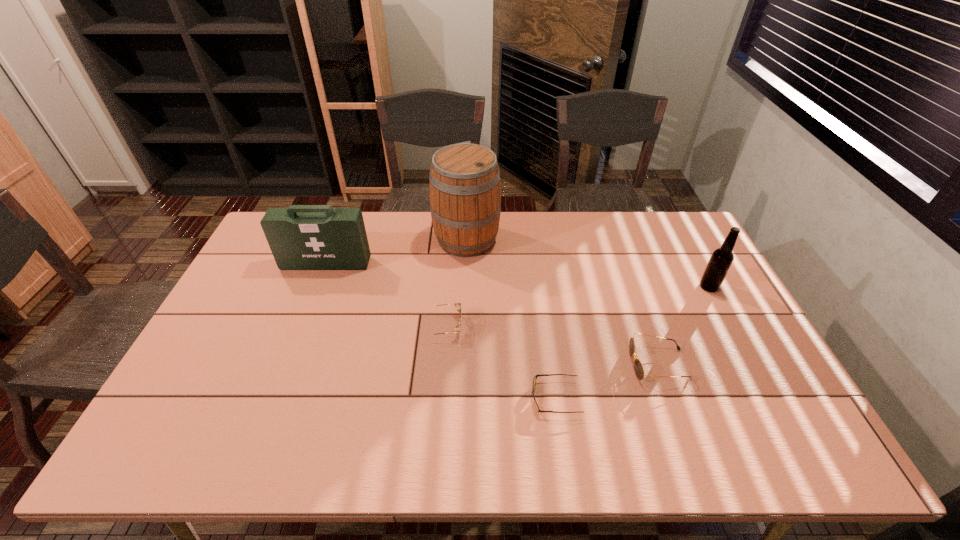
Identify the location of cider. The image size is (960, 540). (464, 184).

I want to click on beer bottle, so click(722, 258).

Where is `the rightmost object`? The image size is (960, 540). the rightmost object is located at coordinates (722, 258).

Where is `the leftmost object`? The height and width of the screenshot is (540, 960). the leftmost object is located at coordinates (301, 237).

You are a GUI agent. You are given a task and a screenshot of the screen. Output one action in this format:
    pyautogui.click(x=<x>, y=<y>)
    Task: Click on the farthest sunglasses
    The width and height of the screenshot is (960, 540).
    Given the screenshot: What is the action you would take?
    pyautogui.click(x=457, y=305)

Find the location of a particular element. This screenshot has width=960, height=540. the fourth farthest object is located at coordinates (457, 305).

Find the location of a particular element. The height and width of the screenshot is (540, 960). the fifth object from left to right is located at coordinates (638, 367).

Locate an element on the screen. the second sunglasses from right to left is located at coordinates (535, 377).

Locate an element on the screen. Image resolution: width=960 pixels, height=540 pixels. the third object from right to left is located at coordinates (535, 377).

Where is `free space located 0.380m on the front of the tallest object`? The image size is (960, 540). free space located 0.380m on the front of the tallest object is located at coordinates (463, 350).